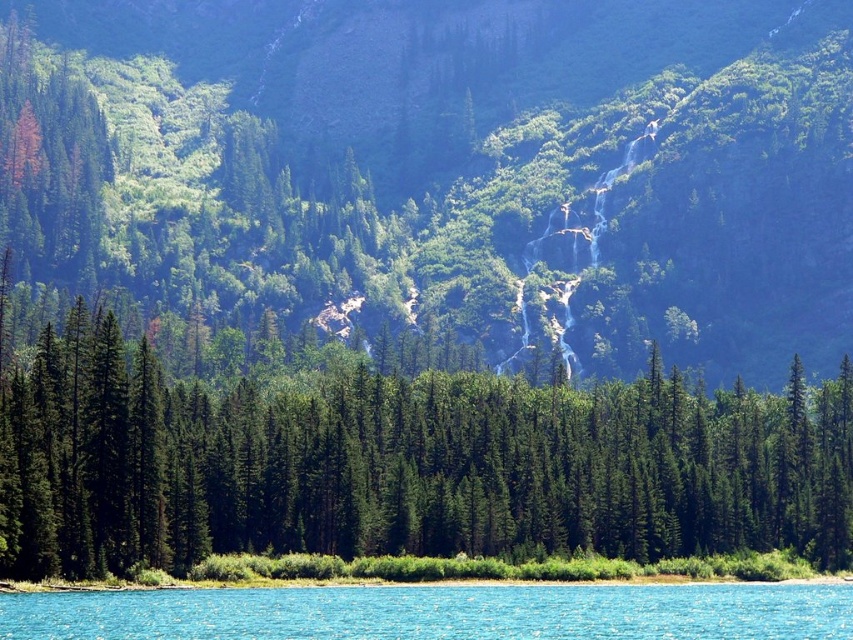
Between point (680, 19) and point (776, 616), which one is positioned behind?

Point (680, 19)

Which is behind, point (838, 26) or point (379, 586)?

Positioned behind is point (838, 26).

Locate an element on the screen. The image size is (853, 640). green textured hillside at center is located at coordinates (447, 170).

Does green matte tree at center have a greater width compared to clear blue water at lower center?

Yes.

Who is shorter, green matte tree at center or clear blue water at lower center?

clear blue water at lower center is shorter.

Image resolution: width=853 pixels, height=640 pixels. Identify the location of green matte tree at center. (399, 465).

Is green textured hillside at center further to the viewer compared to green matte tree at center?

Yes, green textured hillside at center is further from the viewer.

Can you confirm if green textured hillside at center is positioned to the right of green matte tree at center?

In fact, green textured hillside at center is to the left of green matte tree at center.

The height and width of the screenshot is (640, 853). Describe the element at coordinates (447, 170) in the screenshot. I see `green textured hillside at center` at that location.

The height and width of the screenshot is (640, 853). I want to click on green textured hillside at center, so click(x=447, y=170).